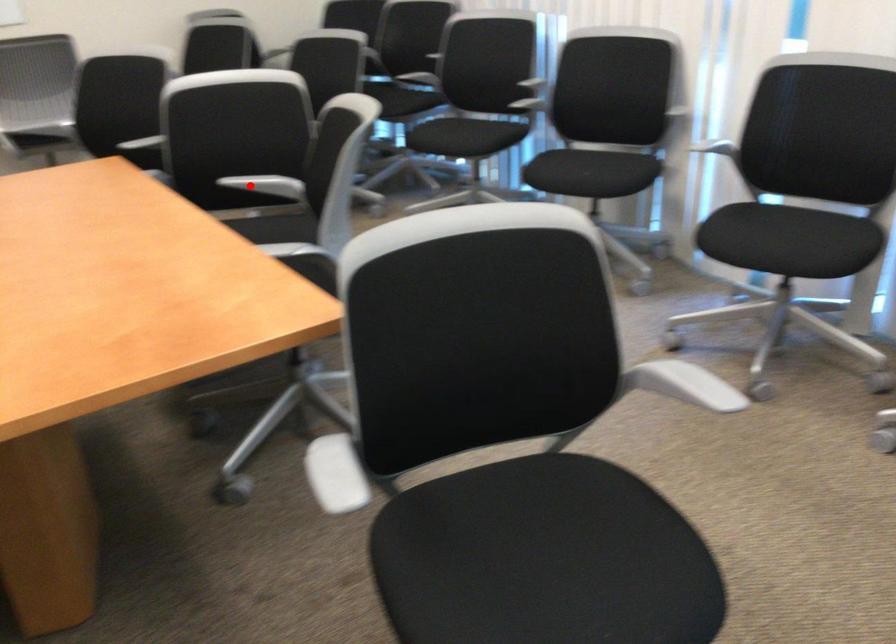
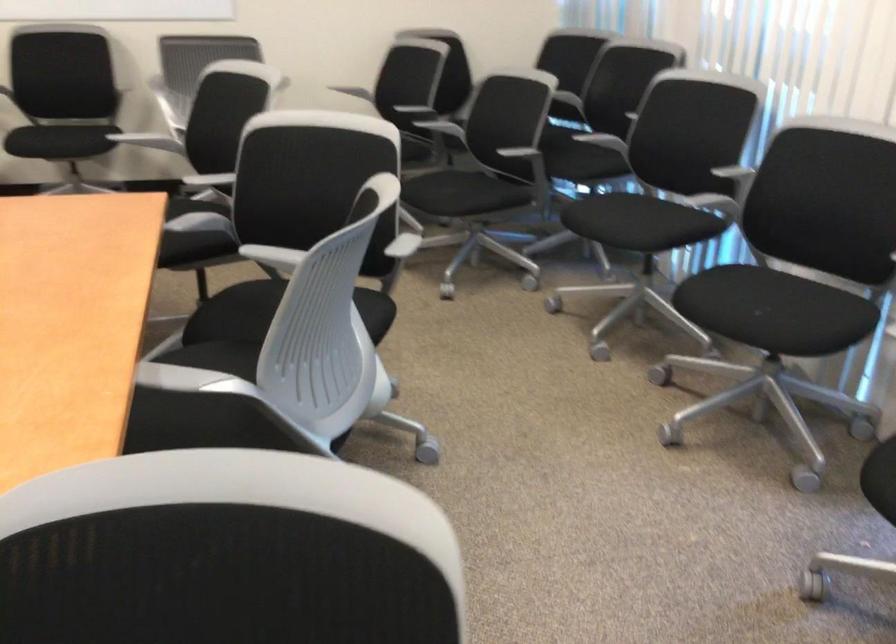
Locate, in the second image, the point that corresponds to the highlighted location in the first image.

(273, 258)